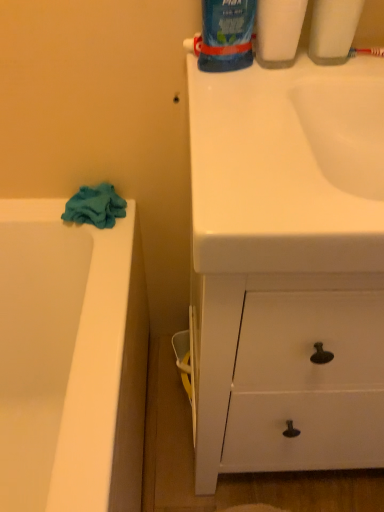
Locate an element on the screen. The image size is (384, 512). vacant region in front of blue glossy toothpaste tube at upper right, which is counted as the 1th cleaning product, starting from the right is located at coordinates (294, 97).